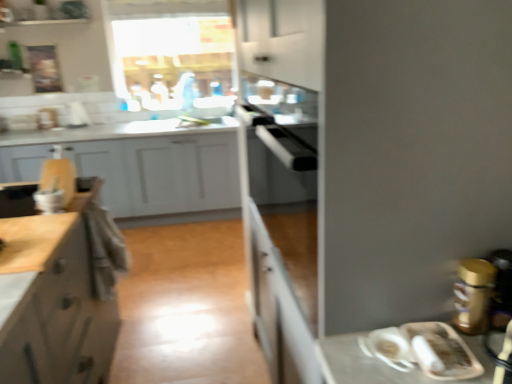
Question: From the image's perspective, is matte white cabinet at left, placed as the 2th cabinetry when sorted from back to front, below white matte cabinet at left, placed as the first cabinetry when sorted from back to front?

Choices:
 (A) no
 (B) yes

Answer: (B)

Question: Is matte white cabinet at left, arranged as the second cabinetry when viewed from the front, not close to white matte cabinet at left, arranged as the 3th cabinetry when viewed from the front?

Choices:
 (A) yes
 (B) no

Answer: (A)

Question: Is matte white cabinet at left, arranged as the second cabinetry when viewed from the front, bigger than white matte cabinet at left, placed as the first cabinetry when sorted from back to front?

Choices:
 (A) no
 (B) yes

Answer: (A)

Question: Is white matte cabinet at left, arranged as the 3th cabinetry when viewed from the front, surrounded by matte white cabinet at left, arranged as the second cabinetry when viewed from the front?

Choices:
 (A) yes
 (B) no

Answer: (B)

Question: Does matte white cabinet at left, arranged as the second cabinetry when viewed from the front, come in front of white matte cabinet at left, placed as the first cabinetry when sorted from back to front?

Choices:
 (A) no
 (B) yes

Answer: (B)

Question: Is point (468, 324) closer or farther from the camera than point (31, 162)?

Choices:
 (A) closer
 (B) farther

Answer: (A)

Question: Considering the positions of gold metallic canister at right and wooden cutting board at left, which is counted as the 3th cabinetry, starting from the back, in the image, is gold metallic canister at right wider or thinner than wooden cutting board at left, which is counted as the 3th cabinetry, starting from the back,?

Choices:
 (A) wide
 (B) thin

Answer: (B)

Question: Is gold metallic canister at right inside the boundaries of wooden cutting board at left, which is counted as the 1th cabinetry, starting from the front, or outside?

Choices:
 (A) inside
 (B) outside

Answer: (B)

Question: Is gold metallic canister at right taller or shorter than wooden cutting board at left, which is counted as the 3th cabinetry, starting from the back?

Choices:
 (A) short
 (B) tall

Answer: (A)

Question: Is matte white cabinet at left, placed as the 2th cabinetry when sorted from back to front, taller or shorter than wooden cutting board at left, which is counted as the 1th cabinetry, starting from the front?

Choices:
 (A) short
 (B) tall

Answer: (B)

Question: Considering the positions of matte white cabinet at left, arranged as the second cabinetry when viewed from the front, and wooden cutting board at left, which is counted as the 1th cabinetry, starting from the front, in the image, is matte white cabinet at left, arranged as the second cabinetry when viewed from the front, wider or thinner than wooden cutting board at left, which is counted as the 1th cabinetry, starting from the front,?

Choices:
 (A) thin
 (B) wide

Answer: (B)

Question: Considering the positions of point (22, 360) and point (106, 150), is point (22, 360) closer or farther from the camera than point (106, 150)?

Choices:
 (A) farther
 (B) closer

Answer: (B)

Question: From the image's perspective, is matte white cabinet at left, placed as the 2th cabinetry when sorted from back to front, above or below wooden cutting board at left, which is counted as the 3th cabinetry, starting from the back?

Choices:
 (A) below
 (B) above

Answer: (A)

Question: Considering their positions, is matte white cabinet at left, arranged as the second cabinetry when viewed from the front, located in front of or behind white matte cabinet at left, placed as the first cabinetry when sorted from back to front?

Choices:
 (A) behind
 (B) front

Answer: (B)

Question: Visually, is matte white cabinet at left, arranged as the second cabinetry when viewed from the front, positioned to the left or to the right of white matte cabinet at left, arranged as the 3th cabinetry when viewed from the front?

Choices:
 (A) left
 (B) right

Answer: (B)